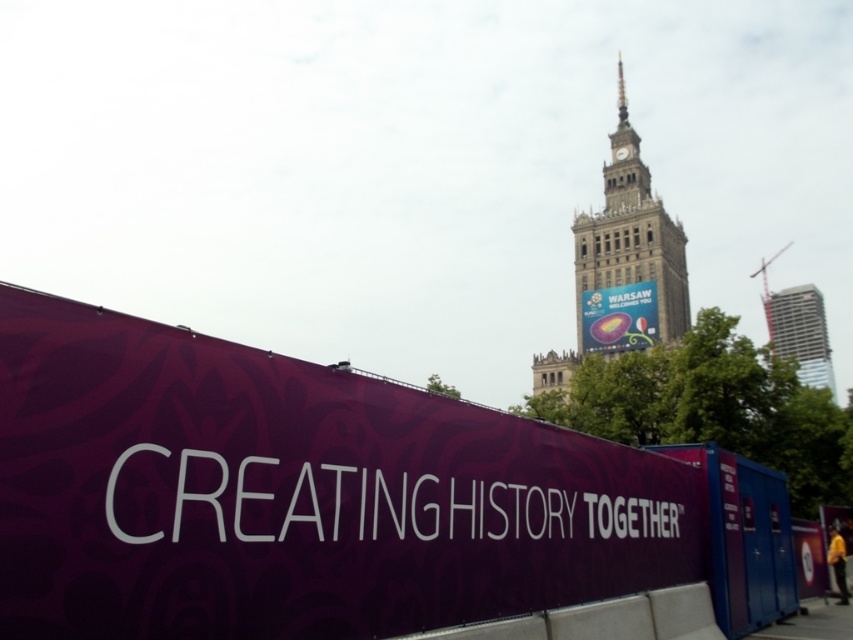
You are an event planner organizing an outdoor exhibition in front of the Palace of Culture and Science. You have two purple matte banners to place at the center. The first banner is labeled as the purple matte banner at center, and the second is labeled as the matte purple banner at center. Which banner should you choose if you want the wider one for the main event announcement?

The purple matte banner at center has a greater width than the matte purple banner at center, so you should choose the purple matte banner at center for the main event announcement.

You are a tourist standing in front of the Palace of Culture and Science in Warsaw. You see the metallic glass skyscraper at upper right and the matte purple banner at center. Which object is positioned to the right of the other?

The metallic glass skyscraper at upper right is to the right of the matte purple banner at center.

You are standing at the point closest to the camera. Which of the two points, point (799, 292) or point (640, 344), is farther away from you?

Point (799, 292) is behind point (640, 344), so it is farther away from you.